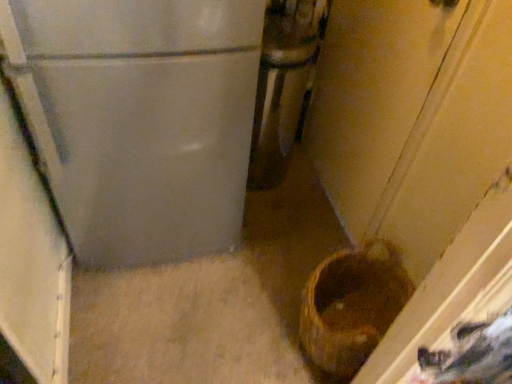
Question: Is metallic silver refrigerator at center in front of or behind brown woven basket at lower right in the image?

Choices:
 (A) behind
 (B) front

Answer: (A)

Question: From a real-world perspective, is metallic silver refrigerator at center positioned above or below brown woven basket at lower right?

Choices:
 (A) below
 (B) above

Answer: (B)

Question: In terms of size, does metallic silver refrigerator at center appear bigger or smaller than brown woven basket at lower right?

Choices:
 (A) big
 (B) small

Answer: (A)

Question: Would you say brown woven basket at lower right is to the left or to the right of metallic silver refrigerator at center in the picture?

Choices:
 (A) right
 (B) left

Answer: (A)

Question: Looking at their shapes, would you say brown woven basket at lower right is wider or thinner than metallic silver refrigerator at center?

Choices:
 (A) thin
 (B) wide

Answer: (A)

Question: Does point (306, 314) appear closer or farther from the camera than point (275, 84)?

Choices:
 (A) closer
 (B) farther

Answer: (A)

Question: In the image, is brown woven basket at lower right positioned in front of or behind metallic silver refrigerator at center?

Choices:
 (A) behind
 (B) front

Answer: (B)